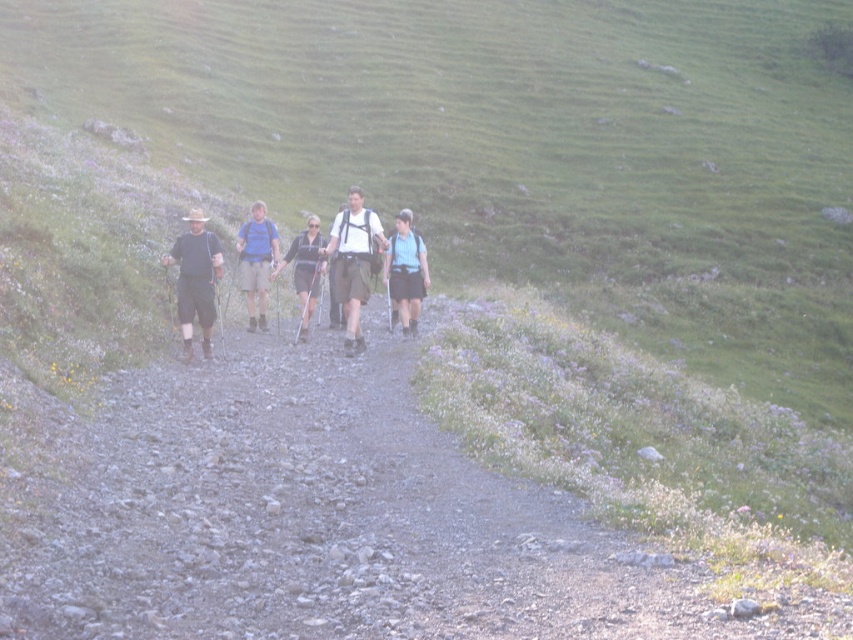
Does matte brown shorts at left appear on the left side of light blue backpack at center?

Correct, you'll find matte brown shorts at left to the left of light blue backpack at center.

At what (x,y) coordinates should I click in order to perform the action: click on matte brown shorts at left. Please return your answer as a coordinate pair (x, y). The image size is (853, 640). Looking at the image, I should click on (195, 278).

The height and width of the screenshot is (640, 853). I want to click on matte brown shorts at left, so click(x=195, y=278).

In the scene shown: Is white fabric backpack at center above light blue backpack at center?

No, white fabric backpack at center is not above light blue backpack at center.

In the scene shown: Is white fabric backpack at center bigger than light blue backpack at center?

Incorrect, white fabric backpack at center is not larger than light blue backpack at center.

Locate an element on the screen. white fabric backpack at center is located at coordinates pyautogui.click(x=352, y=260).

Where is `white fabric backpack at center`? The height and width of the screenshot is (640, 853). white fabric backpack at center is located at coordinates (352, 260).

Based on the photo, can you confirm if blue fabric backpack at center is positioned to the right of matte black jacket at center?

Yes, blue fabric backpack at center is to the right of matte black jacket at center.

Does blue fabric backpack at center lie in front of matte black jacket at center?

Yes, blue fabric backpack at center is closer to the viewer.

Between point (416, 289) and point (315, 221), which one is positioned in front?

Positioned in front is point (416, 289).

Identify the location of blue fabric backpack at center. (405, 272).